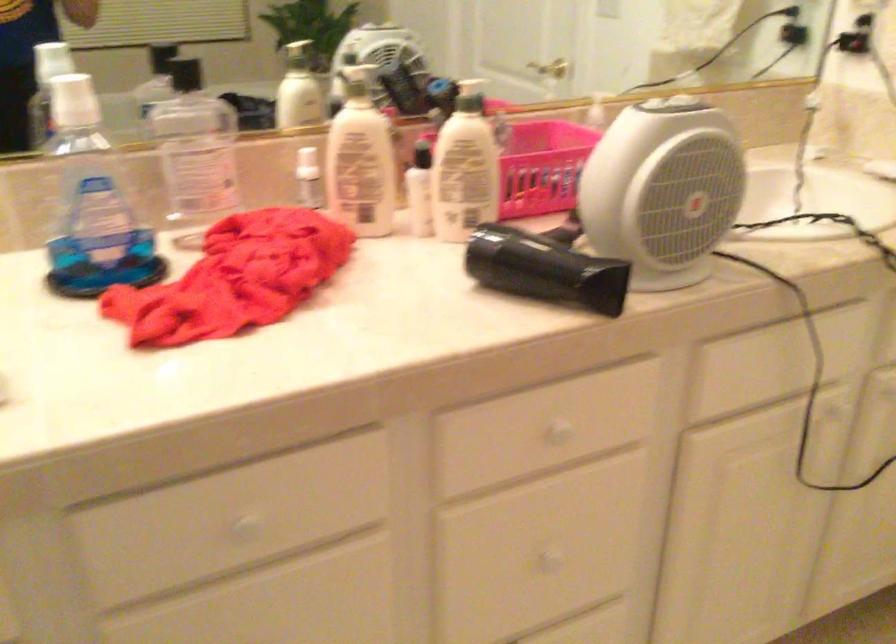
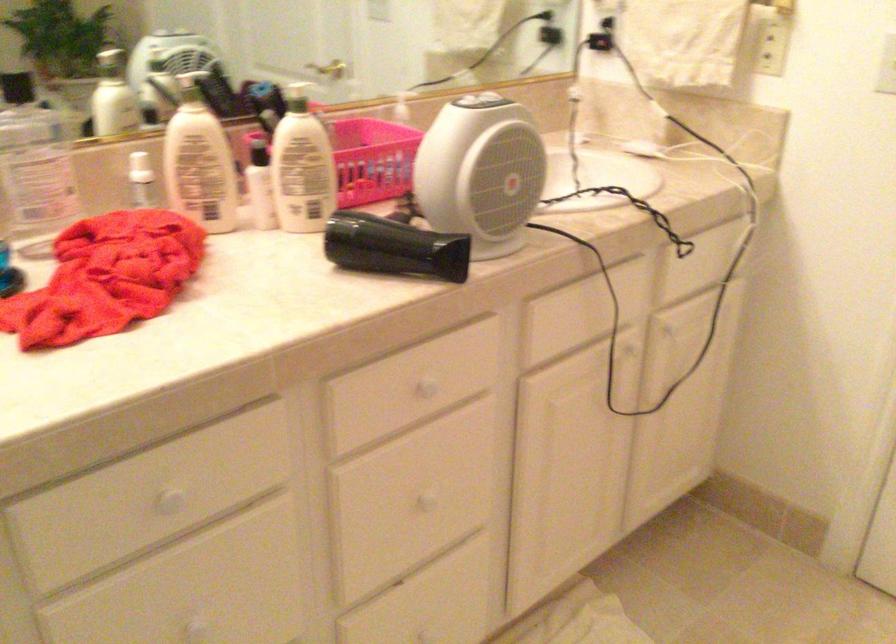
Locate, in the second image, the point that corresponds to point 543,164 in the first image.

(367, 158)